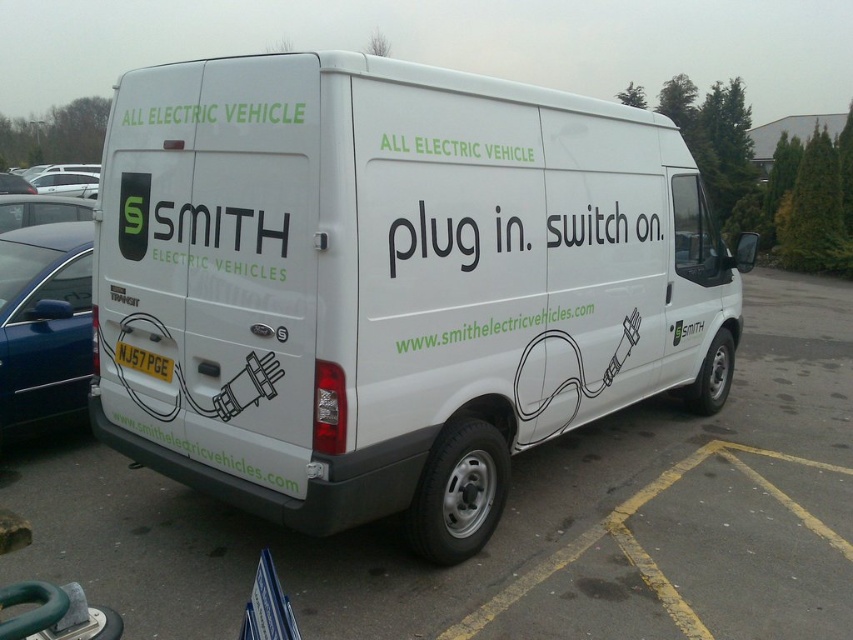
Question: Does white matte van at center have a larger size compared to white van at center?

Choices:
 (A) no
 (B) yes

Answer: (B)

Question: Which object appears closest to the camera in this image?

Choices:
 (A) white van at center
 (B) white matte van at center
 (C) matte black car at left

Answer: (B)

Question: Is white matte van at center positioned at the back of matte black car at left?

Choices:
 (A) no
 (B) yes

Answer: (A)

Question: Among these objects, which one is farthest from the camera?

Choices:
 (A) white van at center
 (B) white matte van at center
 (C) matte black car at left

Answer: (C)

Question: From the image, what is the correct spatial relationship of white matte van at center in relation to white van at center?

Choices:
 (A) above
 (B) below

Answer: (A)

Question: Among these points, which one is nearest to the camera?

Choices:
 (A) (62, 339)
 (B) (169, 308)

Answer: (B)